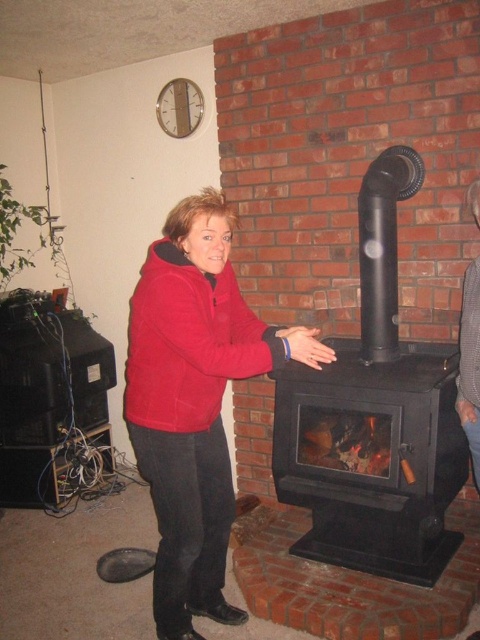
The scene shows a woman near a fireplace. The black matte fireplace at center and the red fleece jacket at center are both visible. Which object takes up more horizontal space in the image?

The black matte fireplace at center has a larger width than the red fleece jacket at center, so it takes up more horizontal space in the image.

You are standing in the room and want to determine which of the two points, point (358, 401) or point (243, 618), is closer to you. Based on the scene, can you identify which point is nearer?

Point (358, 401) is further to the camera than point (243, 618), so the closer point to you is point (243, 618).

You are a guest in this room and want to warm yourself by the fireplace. You are currently standing next to the red fleece jacket at center. Which direction should you move to reach the black matte fireplace at center?

The black matte fireplace at center is positioned on the right side of the red fleece jacket at center, so you should move to your right to reach it.